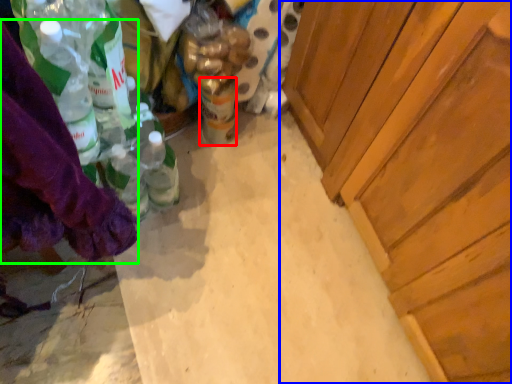
Question: Which is nearer to the beverage (highlighted by a red box)? cabinetry (highlighted by a blue box) or clothing (highlighted by a green box).

Choices:
 (A) cabinetry
 (B) clothing

Answer: (A)